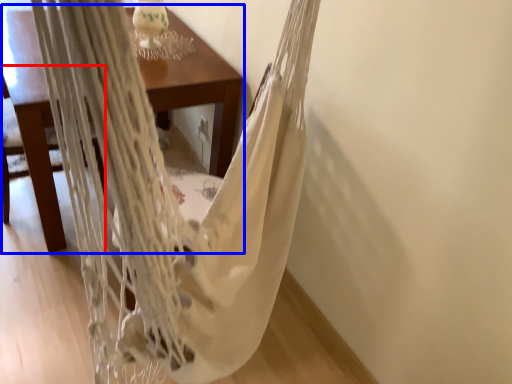
Question: Among these objects, which one is nearest to the camera, armchair (highlighted by a red box) or table (highlighted by a blue box)?

Choices:
 (A) armchair
 (B) table

Answer: (A)